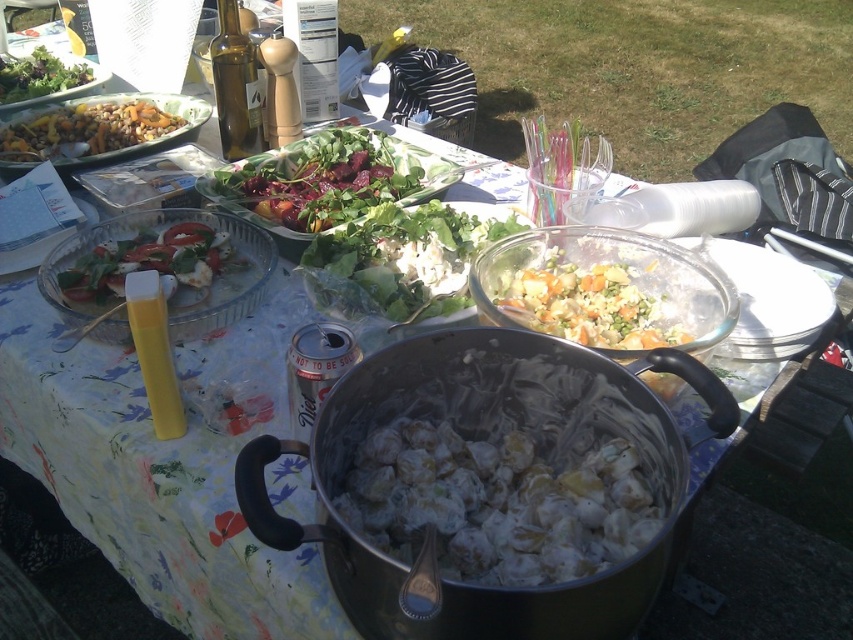
Question: Which object appears farthest from the camera in this image?

Choices:
 (A) translucent glass bowl at center
 (B) golden brown rice pilaf at upper left
 (C) green leafymaterial/textureobject at upper center

Answer: (B)

Question: Does white creamy salad at center have a larger size compared to golden brown rice pilaf at upper left?

Choices:
 (A) yes
 (B) no

Answer: (B)

Question: Which object appears closest to the camera in this image?

Choices:
 (A) green leafy salad at upper left
 (B) translucent glass bowl at center
 (C) green glass bottle at upper left
 (D) green leafy salad at center

Answer: (B)

Question: Among these objects, which one is nearest to the camera?

Choices:
 (A) yellow plastic bottle at center
 (B) green leafymaterial/textureobject at upper center
 (C) golden brown rice pilaf at upper left

Answer: (A)

Question: Does green leafymaterial/textureobject at upper center have a smaller size compared to yellow plastic bottle at center?

Choices:
 (A) yes
 (B) no

Answer: (B)

Question: Can you confirm if green leafy salad at center is smaller than green glass bottle at upper left?

Choices:
 (A) yes
 (B) no

Answer: (B)